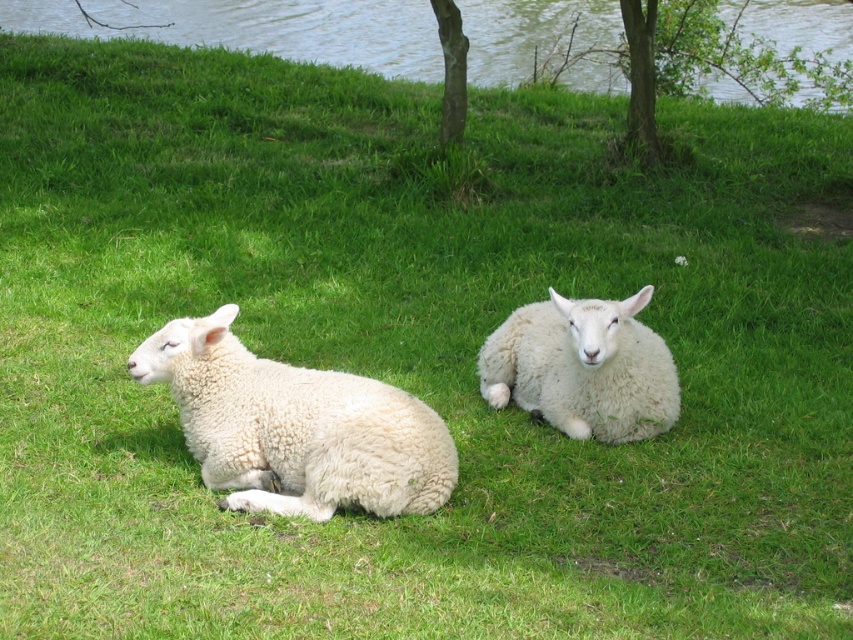
Does white fluffy sheep at left have a lesser height compared to green textured tree at upper center?

Yes, white fluffy sheep at left is shorter than green textured tree at upper center.

The width and height of the screenshot is (853, 640). What are the coordinates of `white fluffy sheep at left` in the screenshot? It's located at (294, 428).

Does white fluffy sheep at left appear under green leafy tree at upper center?

Yes, white fluffy sheep at left is below green leafy tree at upper center.

Between white fluffy sheep at left and green leafy tree at upper center, which one is positioned lower?

white fluffy sheep at left is below.

Between point (260, 444) and point (636, 106), which one is positioned behind?

The point (636, 106) is more distant.

The image size is (853, 640). I want to click on white fluffy sheep at left, so click(x=294, y=428).

Does point (91, 24) lie in front of point (456, 131)?

No.

Based on the photo, can you confirm if clear water at upper center is shorter than green textured tree at upper center?

In fact, clear water at upper center may be taller than green textured tree at upper center.

At what (x,y) coordinates should I click in order to perform the action: click on clear water at upper center. Please return your answer as a coordinate pair (x, y). Image resolution: width=853 pixels, height=640 pixels. Looking at the image, I should click on (257, 28).